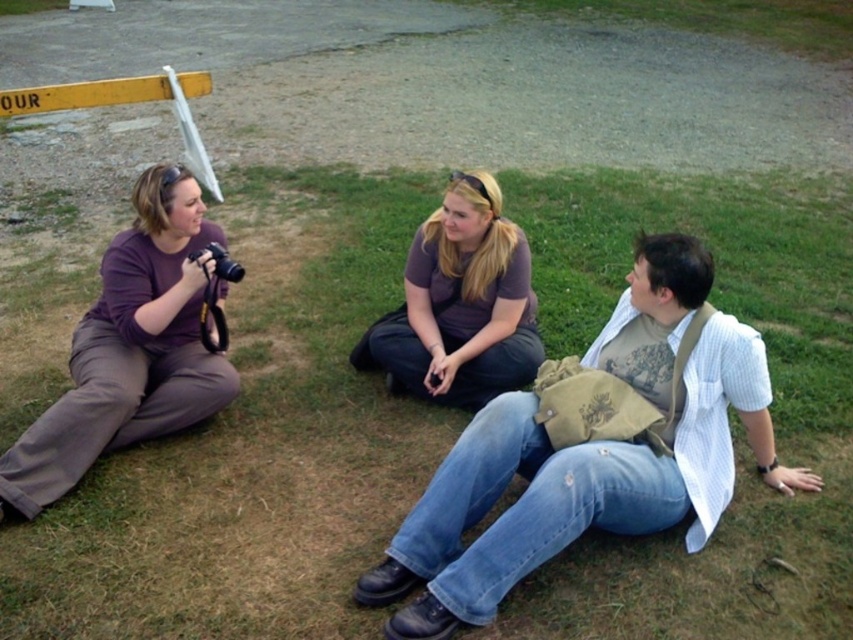
Question: Is green grass at center in front of matte purple shirt at left?

Choices:
 (A) no
 (B) yes

Answer: (B)

Question: Which point is closer to the camera?

Choices:
 (A) purple cotton shirt at center
 (B) denim jeans at center

Answer: (B)

Question: Which of the following is the farthest from the observer?

Choices:
 (A) (395, 614)
 (B) (229, 273)
 (C) (125, 605)

Answer: (B)

Question: Can you confirm if denim jeans at center is positioned to the left of black plastic camera at left?

Choices:
 (A) no
 (B) yes

Answer: (A)

Question: Does green grass at center appear over black plastic camera at left?

Choices:
 (A) yes
 (B) no

Answer: (B)

Question: Which point is farther to the camera?

Choices:
 (A) purple cotton shirt at center
 (B) denim jeans at center

Answer: (A)